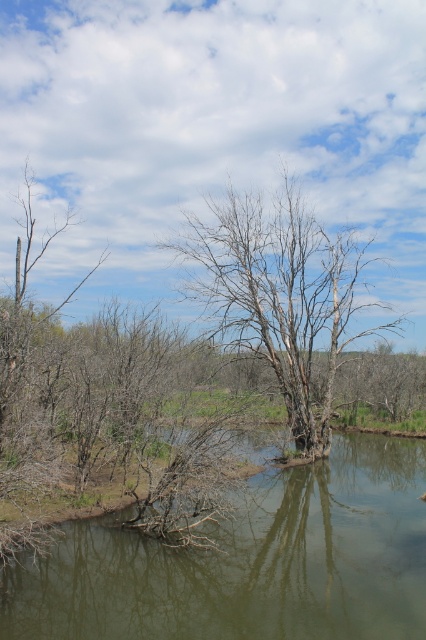
You are standing on the bank of the river and see the green murky water at center and the bare wood tree at center. Which object is taller from your viewpoint?

The bare wood tree at center is taller than the green murky water at center.

You are standing at the edge of the water in the image and want to reach a point closer to you. Which of the two points, point (371, 547) or point (259, 342), should you head towards?

Point (371, 547) is closer to the viewer than point (259, 342), so you should head towards point (371, 547).